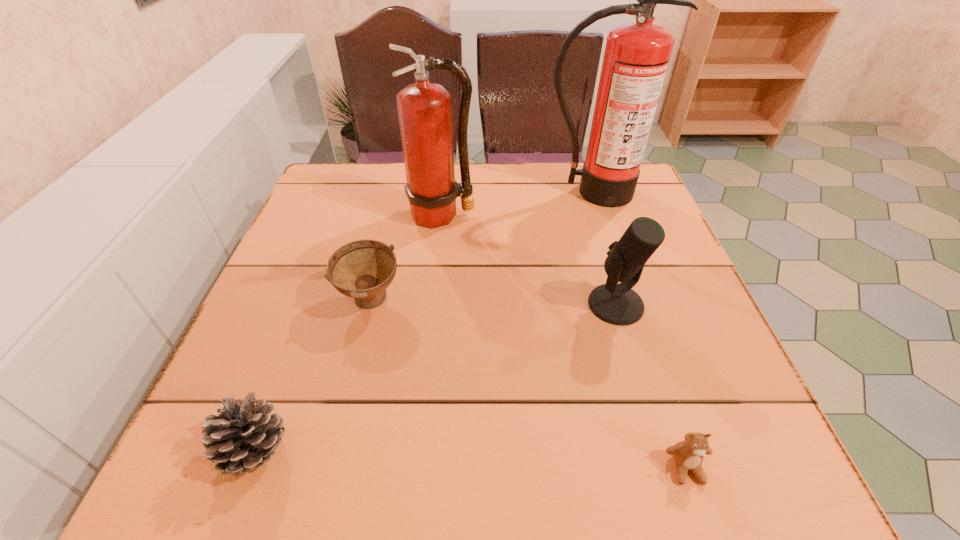
Where is `vacant area in the image that satisfies the following two spatial constraints: 1. at the nozzle of the shorter fire extinguisher; 2. on the right side of the microphone`? Image resolution: width=960 pixels, height=540 pixels. vacant area in the image that satisfies the following two spatial constraints: 1. at the nozzle of the shorter fire extinguisher; 2. on the right side of the microphone is located at coordinates (432, 305).

The image size is (960, 540). Identify the location of vacant space that satisfies the following two spatial constraints: 1. at the nozzle of the shorter fire extinguisher; 2. on the left side of the fourth shortest object. (432, 305).

Find the location of a particular element. Image resolution: width=960 pixels, height=540 pixels. vacant space that satisfies the following two spatial constraints: 1. on the front side of the microphone; 2. on the left side of the soup bowl is located at coordinates (370, 305).

I want to click on free location that satisfies the following two spatial constraints: 1. on the back side of the microphone; 2. on the right side of the leftmost object, so click(310, 305).